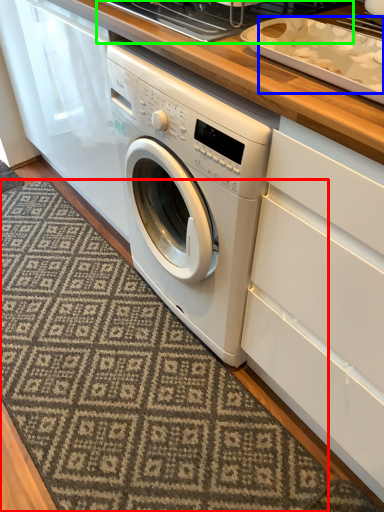
Question: Which is nearer to the doormat (highlighted by a red box)? food (highlighted by a blue box) or appliance (highlighted by a green box).

Choices:
 (A) food
 (B) appliance

Answer: (A)